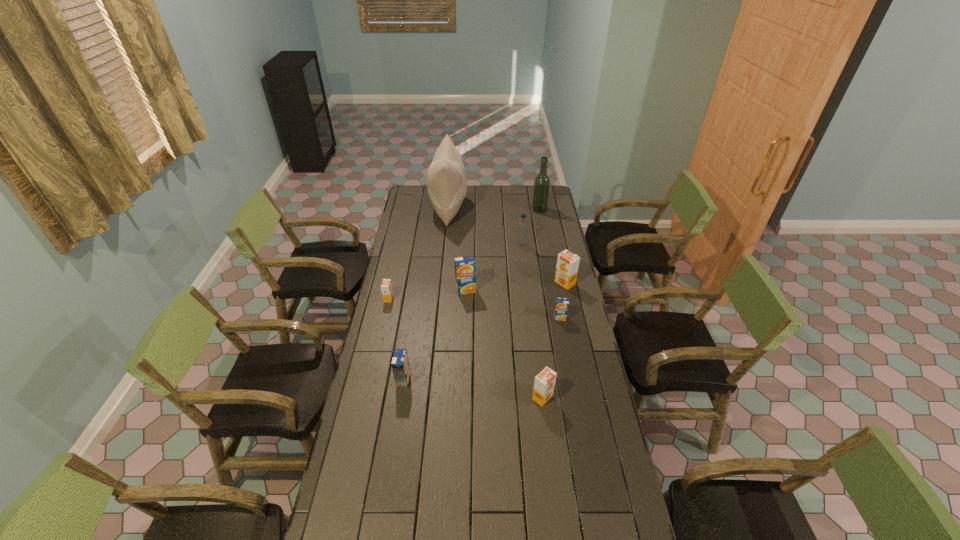
Locate an element on the screen. free area in between the seventh farthest object and the water bottle is located at coordinates (540, 281).

Locate an element on the screen. the fourth closest object relative to the liquor is located at coordinates (465, 267).

Locate which object ranks fourth in proximity to the farthest blue orange_juice. Please provide its 2D coordinates. Your answer should be formatted as a tuple, i.e. [(x, y)], where the tuple contains the x and y coordinates of a point satisfying the conditions above.

[(567, 266)]

Where is `orange_juice object that ranks as the closest to the leftmost object`? The height and width of the screenshot is (540, 960). orange_juice object that ranks as the closest to the leftmost object is located at coordinates (465, 267).

Choose which orange_juice is the second nearest neighbor to the second nearest object. Please provide its 2D coordinates. Your answer should be formatted as a tuple, i.e. [(x, y)], where the tuple contains the x and y coordinates of a point satisfying the conditions above.

[(544, 383)]

Identify which blue orange_juice is the second closest to the second smallest blue orange_juice. Please provide its 2D coordinates. Your answer should be formatted as a tuple, i.e. [(x, y)], where the tuple contains the x and y coordinates of a point satisfying the conditions above.

[(561, 308)]

You are a GUI agent. You are given a task and a screenshot of the screen. Output one action in this format:
    pyautogui.click(x=<x>, y=<y>)
    Task: Click on the second closest blue orange_juice to the smallest orange orange juice
    The image size is (960, 540).
    Given the screenshot: What is the action you would take?
    pyautogui.click(x=400, y=365)

The height and width of the screenshot is (540, 960). In order to click on orange orange juice that is the third closest to the cushion in this screenshot , I will do `click(544, 383)`.

Image resolution: width=960 pixels, height=540 pixels. Find the location of `orange orange juice that is the second closest to the liquor`. orange orange juice that is the second closest to the liquor is located at coordinates (386, 287).

This screenshot has height=540, width=960. Identify the location of free space that satisfies the following two spatial constraints: 1. on the back side of the nearest object; 2. on the right side of the liquor. (519, 210).